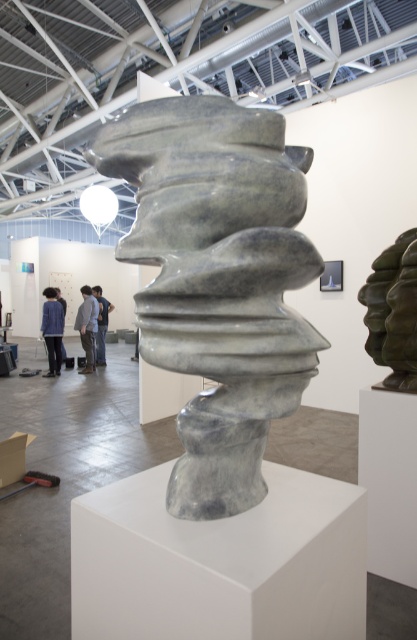
You are an art curator planning to install a new spotlight for the bronze textured sculpture at right. The spotlight can only be placed at the exact coordinates of point (394, 312). Will this placement effectively illuminate the sculpture?

The bronze textured sculpture at right is represented by point (394, 312), so placing the spotlight at those coordinates will directly illuminate the sculpture.

Looking at this image, you are an art curator planning to install a new spotlight for the bronze textured sculpture at right. The gallery uses a coordinate system where the bottom left corner is the origin point. Where should you place the spotlight to ensure it is directly above the sculpture?

The bronze textured sculpture at right is located at coordinates point (394, 312), so the spotlight should be placed at the same coordinates to be directly above it.

Where is the blue denim jacket at center located in the image?

The blue denim jacket at center is located at point (52,330) in the image.